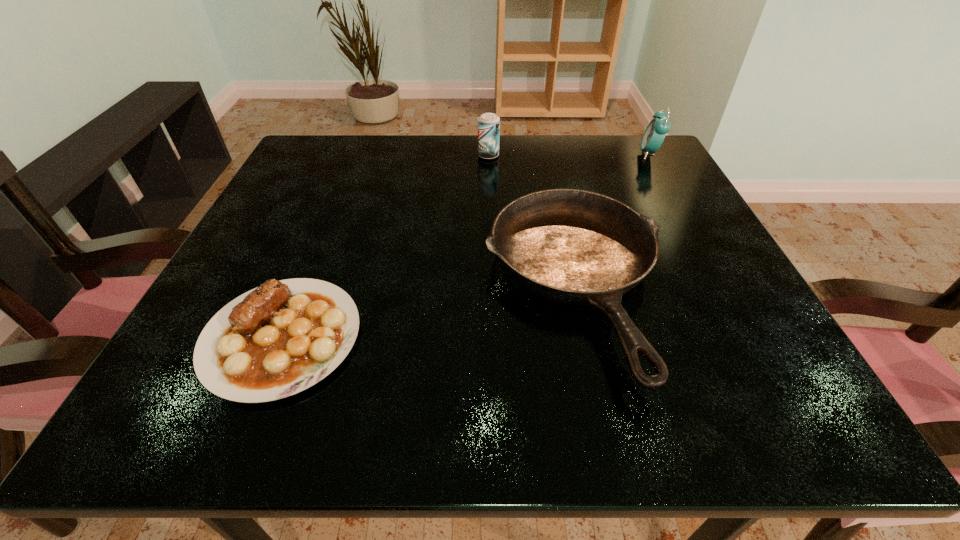
The height and width of the screenshot is (540, 960). Identify the location of object present at the near right corner. (576, 247).

Locate an element on the screen. This screenshot has width=960, height=540. free space at the far edge is located at coordinates (406, 134).

Locate an element on the screen. vacant space at the near edge of the desktop is located at coordinates (487, 389).

I want to click on free region at the left edge, so click(x=305, y=242).

The image size is (960, 540). Identify the location of vacant region at the right edge. (735, 355).

In the image, there is a desktop. Where is `free space at the far left corner`? free space at the far left corner is located at coordinates (366, 151).

Locate an element on the screen. The height and width of the screenshot is (540, 960). vacant space at the far right corner of the desktop is located at coordinates (659, 161).

Locate an element on the screen. This screenshot has height=540, width=960. vacant region between the shortest object and the beer can is located at coordinates 385,247.

Locate an element on the screen. The image size is (960, 540). vacant region between the second shortest object and the leftmost object is located at coordinates (429, 313).

Locate an element on the screen. free space between the beer can and the rightmost object is located at coordinates (569, 155).